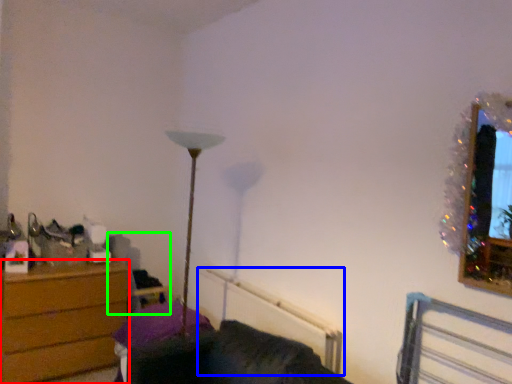
Question: Which object is positioned farthest from chest of drawers (highlighted by a red box)? Select from radiator (highlighted by a blue box) and swivel chair (highlighted by a green box).

Choices:
 (A) radiator
 (B) swivel chair

Answer: (A)